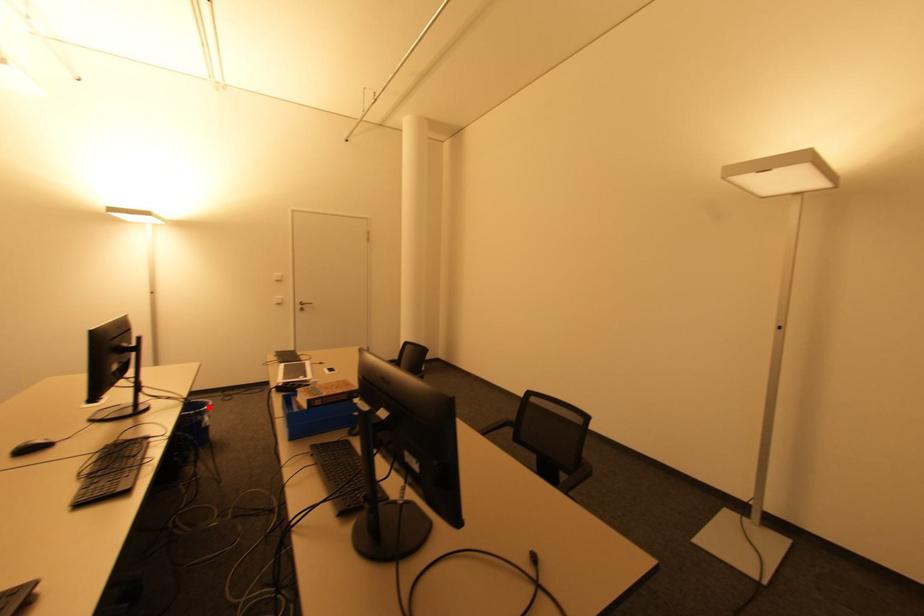
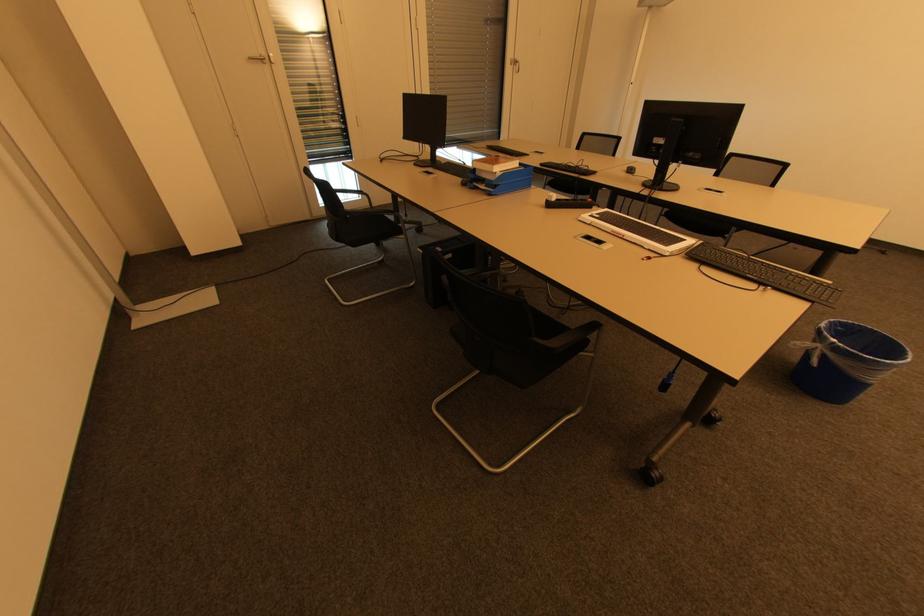
Question: I am providing you with two images of the same scene from different viewpoints. Image1 has a red point marked. In image2, the corresponding 3D location appears at what relative position? Reply with the corresponding letter.

Choices:
 (A) Closer
 (B) Farther

Answer: (B)